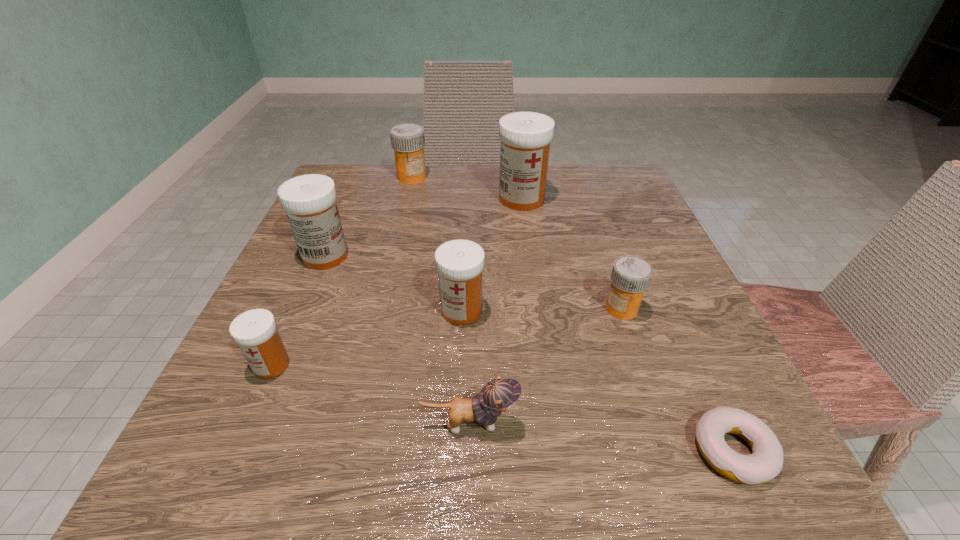
At what (x,y) coordinates should I click in order to perform the action: click on free spot located on the label side of the smaller orange medicine. Please return your answer as a coordinate pair (x, y). Looking at the image, I should click on (491, 308).

Find the location of `vacant region located on the label side of the smaller orange medicine`. vacant region located on the label side of the smaller orange medicine is located at coordinates (372, 308).

I want to click on vacant region located 0.250m on the back of the nearest white medicine, so click(x=323, y=251).

Find the location of a particular element. free space located on the front-facing side of the kitten is located at coordinates (670, 424).

Locate an element on the screen. free location located on the back of the doughnut is located at coordinates (655, 278).

Locate an element on the screen. Image resolution: width=960 pixels, height=540 pixels. kitten positioned at the near edge is located at coordinates (498, 395).

Where is `doughnut located at the near edge`? The height and width of the screenshot is (540, 960). doughnut located at the near edge is located at coordinates (766, 461).

Image resolution: width=960 pixels, height=540 pixels. In order to click on medicine positioned at the right edge in this screenshot , I will do `click(630, 277)`.

Find the location of a particular element. This screenshot has height=540, width=960. doughnut that is positioned at the right edge is located at coordinates point(766,461).

This screenshot has height=540, width=960. Identify the location of object situated at the far left corner. pyautogui.click(x=408, y=140).